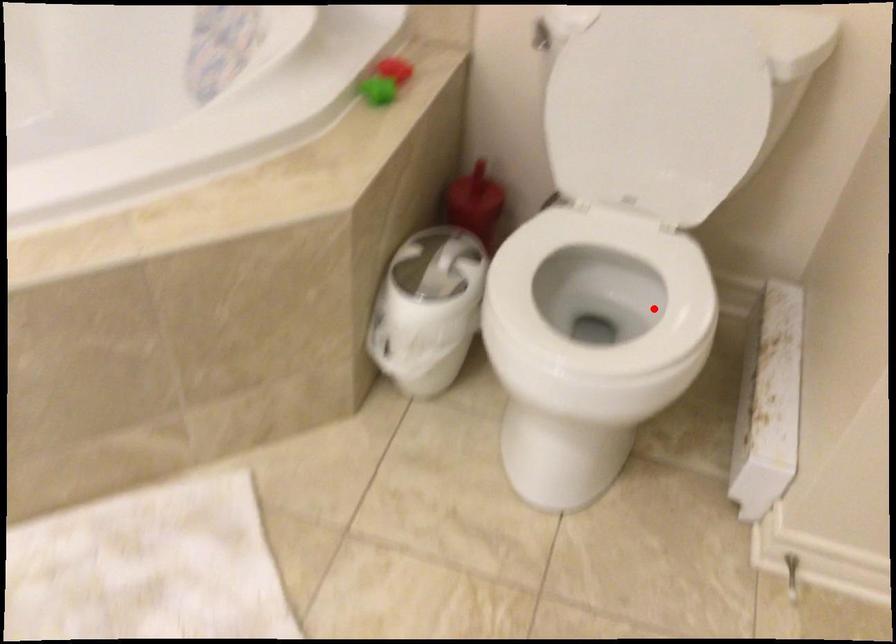
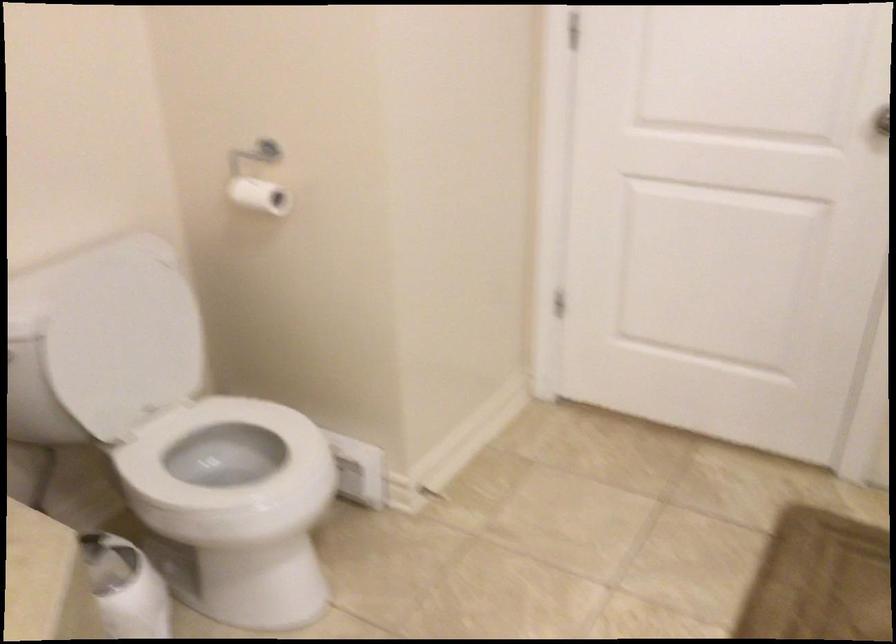
Where in the second image is the point corresponding to the highlighted location from the first image?

(226, 453)